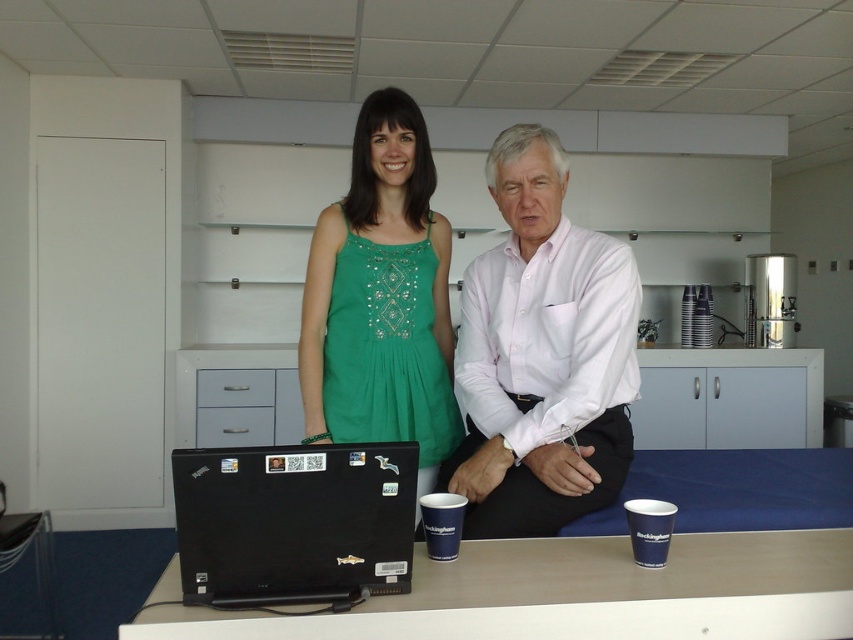
You are an interior designer planning to place a new lamp next to the green embroidered dress at center. Based on the coordinates provided, where should the lamp be positioned relative to the dress?

The green embroidered dress at center is located at point coordinates (381, 298). To place the lamp next to it, position the lamp near these coordinates ensuring it aligns with the dress.

You are a photographer setting up for a group photo. You notice the white cotton shirt at center and the black plastic laptop at center. If your camera has a focal length of 50mm, which object should you focus on first to ensure both are in sharp focus?

The white cotton shirt at center is 15.91 inches away from the black plastic laptop at center. To ensure both are in sharp focus with a 50mm lens, focus on the midpoint between them. However, since depth of field at 50mm can vary, prioritizing the closer object might help. Check the distance and adjust accordingly.

You are a photographer standing in front of the scene. You want to take a closeup shot of the green embroidered dress at center. Considering your current position, is the dress within a 2 meter range for a clear closeup?

The green embroidered dress at center is 1.78 meters away from viewer, which is within the 2 meter range, so yes, it is possible to take a clear closeup.